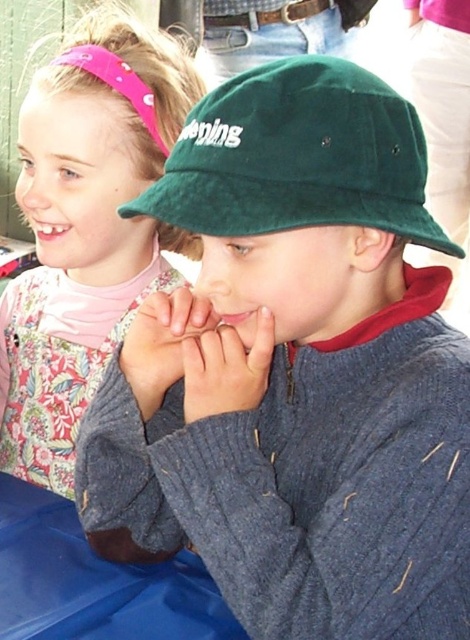
Does green velvety hat at center have a smaller size compared to matte pink fabric at upper left?

No.

Describe the element at coordinates (297, 157) in the screenshot. I see `green velvety hat at center` at that location.

Find the location of a particular element. The height and width of the screenshot is (640, 470). green velvety hat at center is located at coordinates (297, 157).

Is point (65, 449) more distant than point (156, 406)?

Yes, point (65, 449) is behind point (156, 406).

Find the location of a particular element. This screenshot has height=640, width=470. pink fabric headband at upper left is located at coordinates (86, 228).

What do you see at coordinates (227, 369) in the screenshot? The width and height of the screenshot is (470, 640). I see `smooth skin hand at center` at bounding box center [227, 369].

Is smooth skin hand at center wider than matte pink fabric at upper left?

In fact, smooth skin hand at center might be narrower than matte pink fabric at upper left.

Where is `smooth skin hand at center`? The image size is (470, 640). smooth skin hand at center is located at coordinates (227, 369).